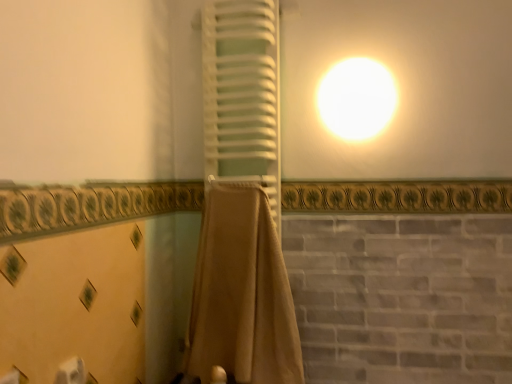
Question: Is white matte towel at center, which is the 1th curtain in top-to-bottom order, shorter than white matte toilet paper at lower left?

Choices:
 (A) no
 (B) yes

Answer: (A)

Question: Is white matte towel at center, which is the 1th curtain in top-to-bottom order, far from white matte toilet paper at lower left?

Choices:
 (A) yes
 (B) no

Answer: (A)

Question: Does white matte towel at center, which is the 1th curtain in top-to-bottom order, come in front of white matte toilet paper at lower left?

Choices:
 (A) no
 (B) yes

Answer: (A)

Question: Could white matte toilet paper at lower left be considered to be inside white matte towel at center, which is the 1th curtain in top-to-bottom order?

Choices:
 (A) yes
 (B) no

Answer: (B)

Question: Is white matte towel at center, which is the 1th curtain in top-to-bottom order, smaller than white matte toilet paper at lower left?

Choices:
 (A) no
 (B) yes

Answer: (A)

Question: Is white matte towel at center, the 2th curtain positioned from the bottom, oriented towards white matte toilet paper at lower left?

Choices:
 (A) yes
 (B) no

Answer: (B)

Question: From a real-world perspective, is beige fabric towel at center, which is the first curtain from bottom to top, on white matte toilet paper at lower left?

Choices:
 (A) yes
 (B) no

Answer: (A)

Question: From the image's perspective, is beige fabric towel at center, which is the first curtain from bottom to top, under white matte toilet paper at lower left?

Choices:
 (A) no
 (B) yes

Answer: (A)

Question: Is beige fabric towel at center, which ranks as the second curtain in top-to-bottom order, oriented away from white matte toilet paper at lower left?

Choices:
 (A) yes
 (B) no

Answer: (B)

Question: Can you confirm if beige fabric towel at center, which ranks as the second curtain in top-to-bottom order, is taller than white matte toilet paper at lower left?

Choices:
 (A) yes
 (B) no

Answer: (A)

Question: Can you confirm if beige fabric towel at center, which ranks as the second curtain in top-to-bottom order, is wider than white matte toilet paper at lower left?

Choices:
 (A) no
 (B) yes

Answer: (B)

Question: Does beige fabric towel at center, which ranks as the second curtain in top-to-bottom order, lie behind white matte toilet paper at lower left?

Choices:
 (A) yes
 (B) no

Answer: (A)

Question: Can you confirm if white matte toilet paper at lower left is positioned to the right of beige fabric towel at center, which ranks as the second curtain in top-to-bottom order?

Choices:
 (A) no
 (B) yes

Answer: (A)